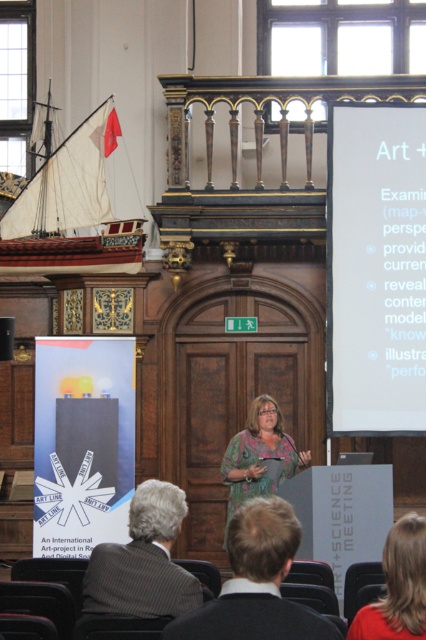
Is point (367, 205) positioned behind point (386, 564)?

Yes, it is behind point (386, 564).

Is point (348, 333) farther from viewer compared to point (414, 560)?

Yes, it is behind point (414, 560).

Locate an element on the screen. This screenshot has width=426, height=640. white paper at upper right is located at coordinates (376, 269).

Is wooden model ship at left smaller than gray wool suit at lower left?

Indeed, wooden model ship at left has a smaller size compared to gray wool suit at lower left.

This screenshot has height=640, width=426. What are the coordinates of `wooden model ship at left` in the screenshot? It's located at (71, 209).

Where is `wooden model ship at left`? This screenshot has height=640, width=426. wooden model ship at left is located at coordinates (71, 209).

Identify the location of wooden model ship at left. This screenshot has height=640, width=426. [71, 209].

Does dark brown hair at lower center have a greater width compared to green floral dress at center?

Yes, dark brown hair at lower center is wider than green floral dress at center.

Identify the location of dark brown hair at lower center. (256, 582).